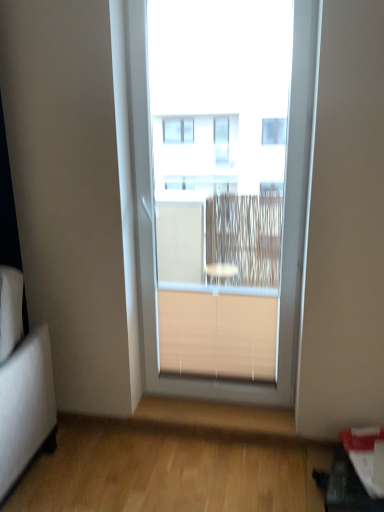
I want to click on vacant space in transparent glass window at center (from a real-world perspective), so click(211, 405).